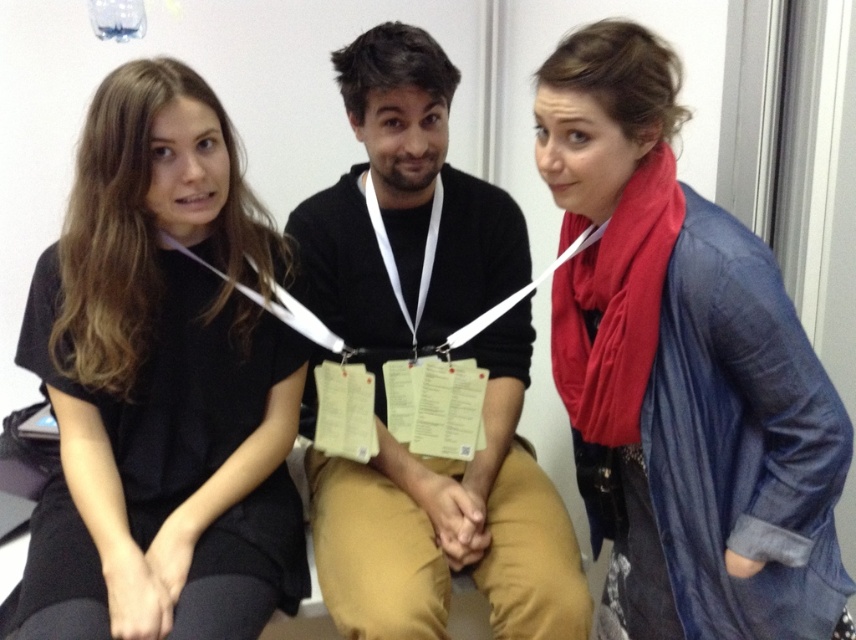
Question: Which point is farther to the camera?

Choices:
 (A) (397, 305)
 (B) (76, 296)

Answer: (A)

Question: Is denim jacket at right to the left of white fabric lanyard at center from the viewer's perspective?

Choices:
 (A) no
 (B) yes

Answer: (A)

Question: Does denim jacket at right appear on the right side of black cotton hoodie at center?

Choices:
 (A) yes
 (B) no

Answer: (A)

Question: Based on their relative distances, which object is farther from the black cotton hoodie at center?

Choices:
 (A) white fabric lanyard at center
 (B) denim jacket at right
 (C) black matte shirt at left

Answer: (B)

Question: Which of the following is the closest to the observer?

Choices:
 (A) (288, 600)
 (B) (782, 384)
 (C) (372, 148)

Answer: (B)

Question: Can you confirm if denim jacket at right is positioned to the right of black cotton hoodie at center?

Choices:
 (A) no
 (B) yes

Answer: (B)